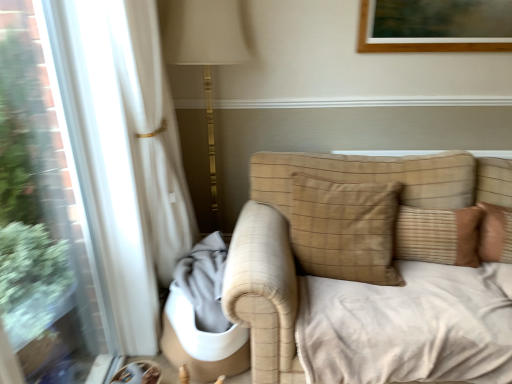
Question: Is beige textured pillow at center, placed as the 1th pillow when sorted from left to right, wider than brown textured pillow at center, which is the 1th pillow from right to left?

Choices:
 (A) no
 (B) yes

Answer: (B)

Question: Can you confirm if beige textured pillow at center, placed as the 1th pillow when sorted from left to right, is positioned to the right of brown textured pillow at center, the second pillow positioned from the left?

Choices:
 (A) yes
 (B) no

Answer: (B)

Question: From a real-world perspective, is beige textured pillow at center, which is counted as the 2th pillow, starting from the right, over brown textured pillow at center, which is the 1th pillow from right to left?

Choices:
 (A) yes
 (B) no

Answer: (A)

Question: Is beige textured pillow at center, which is counted as the 2th pillow, starting from the right, not inside brown textured pillow at center, which is the 1th pillow from right to left?

Choices:
 (A) no
 (B) yes

Answer: (B)

Question: Does beige textured pillow at center, which is counted as the 2th pillow, starting from the right, have a larger size compared to brown textured pillow at center, which is the 1th pillow from right to left?

Choices:
 (A) no
 (B) yes

Answer: (B)

Question: Is beige textured pillow at center, which is counted as the 2th pillow, starting from the right, looking in the opposite direction of brown textured pillow at center, the second pillow positioned from the left?

Choices:
 (A) no
 (B) yes

Answer: (A)

Question: Could you tell me if brown textured pillow at center, which is the 1th pillow from right to left, is turned towards beige textured pillow at center, placed as the 1th pillow when sorted from left to right?

Choices:
 (A) yes
 (B) no

Answer: (B)

Question: Are brown textured pillow at center, the second pillow positioned from the left, and beige textured pillow at center, which is counted as the 2th pillow, starting from the right, located far from each other?

Choices:
 (A) no
 (B) yes

Answer: (A)

Question: Does brown textured pillow at center, which is the 1th pillow from right to left, have a larger size compared to beige textured pillow at center, which is counted as the 2th pillow, starting from the right?

Choices:
 (A) yes
 (B) no

Answer: (B)

Question: Considering the relative positions of brown textured pillow at center, the second pillow positioned from the left, and beige textured pillow at center, which is counted as the 2th pillow, starting from the right, in the image provided, is brown textured pillow at center, the second pillow positioned from the left, to the right of beige textured pillow at center, which is counted as the 2th pillow, starting from the right, from the viewer's perspective?

Choices:
 (A) yes
 (B) no

Answer: (A)

Question: Does brown textured pillow at center, the second pillow positioned from the left, come behind beige textured pillow at center, placed as the 1th pillow when sorted from left to right?

Choices:
 (A) no
 (B) yes

Answer: (B)

Question: Is brown textured pillow at center, the second pillow positioned from the left, turned away from beige textured pillow at center, placed as the 1th pillow when sorted from left to right?

Choices:
 (A) no
 (B) yes

Answer: (A)

Question: From the image's perspective, is brown textured pillow at center, which is the 1th pillow from right to left, positioned above or below beige textured pillow at center, which is counted as the 2th pillow, starting from the right?

Choices:
 (A) below
 (B) above

Answer: (A)